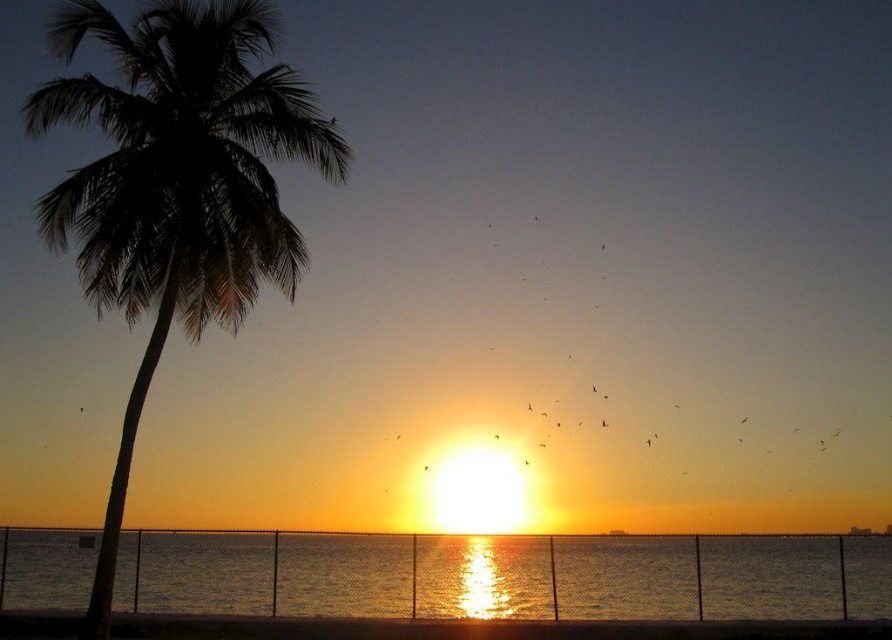
You are planning to build a small sandcastle on the beach. You need a wide enough area to construct it. Given that the shiny metallic water at center and the smooth sand at lower center are both visible in the scene, which area would be more suitable for building your sandcastle?

The shiny metallic water at center has a larger width than the smooth sand at lower center, so the shiny metallic water at center would be more suitable for building the sandcastle due to its wider area.